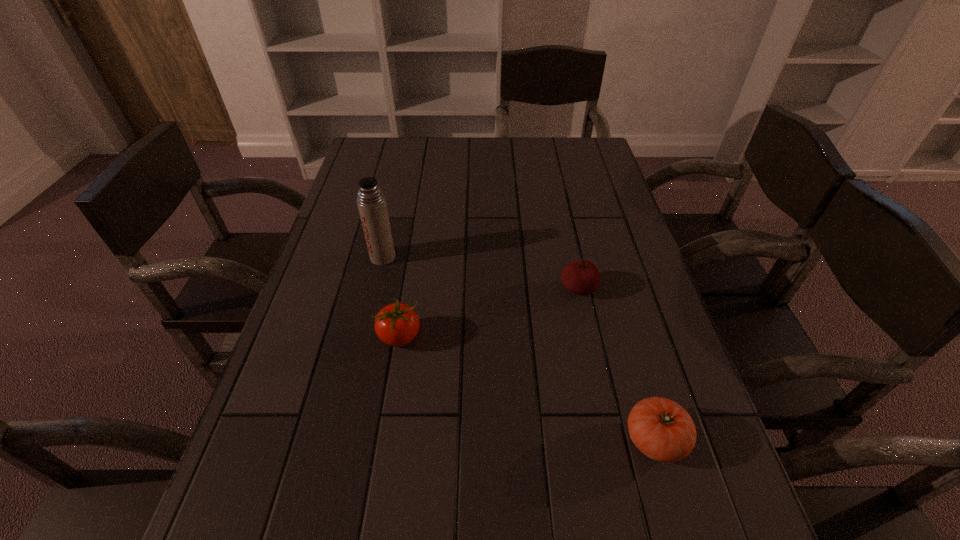
Locate an element on the screen. Image resolution: width=960 pixels, height=540 pixels. object present at the left edge is located at coordinates (371, 202).

Where is `free region at the far edge of the desktop`? free region at the far edge of the desktop is located at coordinates (461, 167).

This screenshot has width=960, height=540. I want to click on free space at the left edge, so click(x=355, y=204).

This screenshot has height=540, width=960. Find the location of `free space at the right edge`. free space at the right edge is located at coordinates (625, 303).

In the image, there is a desktop. Where is `free space at the far left corner`? The height and width of the screenshot is (540, 960). free space at the far left corner is located at coordinates (399, 154).

The height and width of the screenshot is (540, 960). In order to click on vacant space that's between the nearest object and the third nearest object in this screenshot , I will do `click(616, 364)`.

Locate an element on the screen. This screenshot has height=540, width=960. free space between the nearest tomato and the third farthest object is located at coordinates (527, 388).

The width and height of the screenshot is (960, 540). What are the coordinates of `free space between the farthest tomato and the nearest object` in the screenshot? It's located at (616, 364).

At what (x,y) coordinates should I click in order to perform the action: click on free space between the nearest object and the second farthest object. Please return your answer as a coordinate pair (x, y). Looking at the image, I should click on (616, 364).

Where is `vacant area that lies between the second nearest object and the nearest tomato`? vacant area that lies between the second nearest object and the nearest tomato is located at coordinates (527, 388).